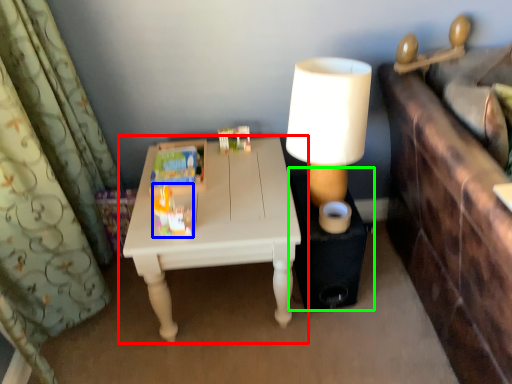
Question: Which object is the closest to the table (highlighted by a red box)? Choose among these: toy (highlighted by a blue box) or side table (highlighted by a green box).

Choices:
 (A) toy
 (B) side table

Answer: (A)